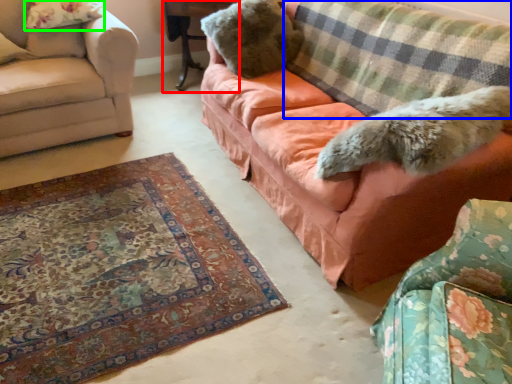
Question: Estimate the real-world distances between objects in this image. Which object is closer to table (highlighted by a red box), plaid (highlighted by a blue box) or pillow (highlighted by a green box)?

Choices:
 (A) plaid
 (B) pillow

Answer: (B)